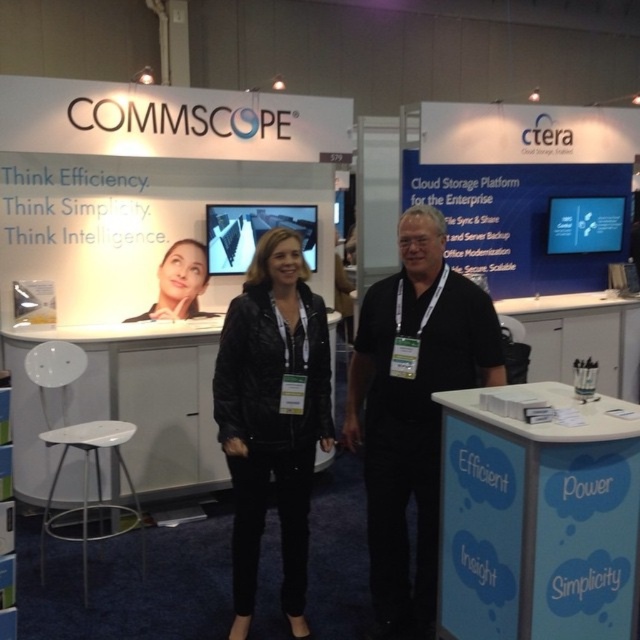
Between black leather jacket at center and matte black jacket at center, which one appears on the left side from the viewer's perspective?

Positioned to the left is matte black jacket at center.

Is black leather jacket at center positioned before matte black jacket at center?

Yes, black leather jacket at center is in front of matte black jacket at center.

Is point (285, 465) closer to camera compared to point (160, 296)?

Yes.

Locate an element on the screen. black leather jacket at center is located at coordinates (273, 416).

Where is `blue paperboard at center`? The image size is (640, 640). blue paperboard at center is located at coordinates coord(538,515).

Is blue paperboard at center smaller than white plastic stool at lower left?

Correct, blue paperboard at center occupies less space than white plastic stool at lower left.

Image resolution: width=640 pixels, height=640 pixels. What do you see at coordinates (538, 515) in the screenshot?
I see `blue paperboard at center` at bounding box center [538, 515].

Locate an element on the screen. The height and width of the screenshot is (640, 640). blue paperboard at center is located at coordinates (538, 515).

How much distance is there between white plastic desk at center and white plastic stool at lower left?

They are 32.76 centimeters apart.

Is point (12, 364) positioned behind point (88, 433)?

That is True.

Where is `white plastic desk at center`? Image resolution: width=640 pixels, height=640 pixels. white plastic desk at center is located at coordinates (129, 404).

This screenshot has height=640, width=640. I want to click on white plastic desk at center, so click(x=129, y=404).